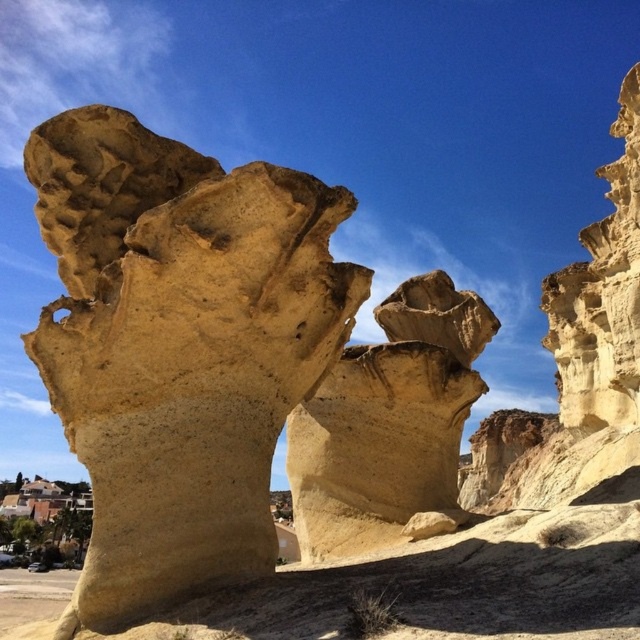
Is sandstone rock formation at center above smooth beige rock at center?

Correct, sandstone rock formation at center is located above smooth beige rock at center.

Image resolution: width=640 pixels, height=640 pixels. What do you see at coordinates (179, 346) in the screenshot?
I see `sandstone rock formation at center` at bounding box center [179, 346].

Where is `sandstone rock formation at center`? The width and height of the screenshot is (640, 640). sandstone rock formation at center is located at coordinates (179, 346).